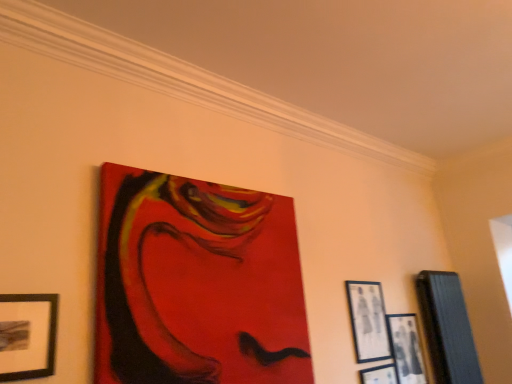
What is the approximate height of matte acrylic painting at upper center, marked as the 5th picture frame in a right-to-left arrangement?

matte acrylic painting at upper center, marked as the 5th picture frame in a right-to-left arrangement, is 32.74 inches in height.

What do you see at coordinates (447, 328) in the screenshot? Image resolution: width=512 pixels, height=384 pixels. I see `wooden picture frame at right, which is the 5th picture frame in left-to-right order` at bounding box center [447, 328].

At what (x,y) coordinates should I click in order to perform the action: click on matte black picture frame at upper right, which is the 4th picture frame from right to left. Please return your answer as a coordinate pair (x, y). The height and width of the screenshot is (384, 512). Looking at the image, I should click on (368, 321).

Describe the element at coordinates (368, 321) in the screenshot. I see `matte black picture frame at upper right, which is the 4th picture frame from right to left` at that location.

Locate an element on the screen. The width and height of the screenshot is (512, 384). matte black picture frame at lower right, which appears as the third picture frame when viewed from the left is located at coordinates (379, 375).

Who is bigger, black matte picture frame at lower right, the fourth picture frame viewed from the left, or matte black picture frame at upper right, which is the 4th picture frame from right to left?

With larger size is matte black picture frame at upper right, which is the 4th picture frame from right to left.

From the image's perspective, is black matte picture frame at lower right, the fourth picture frame viewed from the left, below matte black picture frame at upper right, which is the 4th picture frame from right to left?

Indeed, from the image's perspective, black matte picture frame at lower right, the fourth picture frame viewed from the left, is shown beneath matte black picture frame at upper right, which is the 4th picture frame from right to left.

Is black matte picture frame at lower right, positioned as the 2th picture frame in right-to-left order, not close to matte black picture frame at upper right, which ranks as the 2th picture frame in left-to-right order?

That's not correct — black matte picture frame at lower right, positioned as the 2th picture frame in right-to-left order, is a little close to matte black picture frame at upper right, which ranks as the 2th picture frame in left-to-right order.

Does matte black picture frame at lower right, which is the 3th picture frame from right to left, touch matte black picture frame at upper right, which ranks as the 2th picture frame in left-to-right order?

No, matte black picture frame at lower right, which is the 3th picture frame from right to left, is not making contact with matte black picture frame at upper right, which ranks as the 2th picture frame in left-to-right order.

From the image's perspective, is matte black picture frame at lower right, which is the 3th picture frame from right to left, under matte black picture frame at upper right, which ranks as the 2th picture frame in left-to-right order?

Correct, matte black picture frame at lower right, which is the 3th picture frame from right to left, appears lower than matte black picture frame at upper right, which ranks as the 2th picture frame in left-to-right order, in the image.

Who is shorter, matte black picture frame at lower right, which appears as the third picture frame when viewed from the left, or matte black picture frame at upper right, which ranks as the 2th picture frame in left-to-right order?

matte black picture frame at upper right, which ranks as the 2th picture frame in left-to-right order, is shorter.

Could you tell me if matte black picture frame at lower right, which is the 3th picture frame from right to left, is facing matte black picture frame at upper right, which is the 4th picture frame from right to left?

No, matte black picture frame at lower right, which is the 3th picture frame from right to left, is not aimed at matte black picture frame at upper right, which is the 4th picture frame from right to left.

In terms of width, does matte acrylic painting at upper center, marked as the 5th picture frame in a right-to-left arrangement, look wider or thinner when compared to matte black picture frame at upper right, which is the 4th picture frame from right to left?

matte acrylic painting at upper center, marked as the 5th picture frame in a right-to-left arrangement, is wider than matte black picture frame at upper right, which is the 4th picture frame from right to left.

Would you consider matte acrylic painting at upper center, which is counted as the first picture frame, starting from the left, to be distant from matte black picture frame at upper right, which ranks as the 2th picture frame in left-to-right order?

No, there isn't a large distance between matte acrylic painting at upper center, which is counted as the first picture frame, starting from the left, and matte black picture frame at upper right, which ranks as the 2th picture frame in left-to-right order.

Is matte black picture frame at upper right, which ranks as the 2th picture frame in left-to-right order, at the back of matte acrylic painting at upper center, which is counted as the first picture frame, starting from the left?

No, matte acrylic painting at upper center, which is counted as the first picture frame, starting from the left, is not facing away from matte black picture frame at upper right, which ranks as the 2th picture frame in left-to-right order.

Does point (447, 294) come closer to viewer compared to point (364, 345)?

No.

Considering the relative sizes of wooden picture frame at right, which is the 5th picture frame in left-to-right order, and matte black picture frame at upper right, which ranks as the 2th picture frame in left-to-right order, in the image provided, is wooden picture frame at right, which is the 5th picture frame in left-to-right order, shorter than matte black picture frame at upper right, which ranks as the 2th picture frame in left-to-right order,?

No.

Would you consider wooden picture frame at right, which is the 5th picture frame in left-to-right order, to be distant from matte black picture frame at upper right, which is the 4th picture frame from right to left?

No, there isn't a large distance between wooden picture frame at right, which is the 5th picture frame in left-to-right order, and matte black picture frame at upper right, which is the 4th picture frame from right to left.

Find the location of a particular element. The height and width of the screenshot is (384, 512). the 1st picture frame positioned above the wooden picture frame at right, which is the 1th picture frame in right-to-left order (from the image's perspective) is located at coordinates (368, 321).

In the scene shown: Considering the sizes of objects wooden picture frame at right, which is the 1th picture frame in right-to-left order, and black matte picture frame at lower right, the fourth picture frame viewed from the left, in the image provided, who is taller, wooden picture frame at right, which is the 1th picture frame in right-to-left order, or black matte picture frame at lower right, the fourth picture frame viewed from the left,?

wooden picture frame at right, which is the 1th picture frame in right-to-left order, is taller.

Do you think wooden picture frame at right, which is the 1th picture frame in right-to-left order, is within black matte picture frame at lower right, the fourth picture frame viewed from the left, or outside of it?

wooden picture frame at right, which is the 1th picture frame in right-to-left order, cannot be found inside black matte picture frame at lower right, the fourth picture frame viewed from the left.

I want to click on picture frame that is the 1st object located in front of the wooden picture frame at right, which is the 5th picture frame in left-to-right order, so click(x=406, y=348).

Locate an element on the screen. the 4th picture frame above the matte black picture frame at lower right, which appears as the third picture frame when viewed from the left (from the image's perspective) is located at coordinates (197, 283).

Which of these two, matte acrylic painting at upper center, which is counted as the first picture frame, starting from the left, or matte black picture frame at lower right, which appears as the third picture frame when viewed from the left, stands taller?

matte acrylic painting at upper center, which is counted as the first picture frame, starting from the left.

Is matte acrylic painting at upper center, which is counted as the first picture frame, starting from the left, thinner than matte black picture frame at lower right, which appears as the third picture frame when viewed from the left?

No, matte acrylic painting at upper center, which is counted as the first picture frame, starting from the left, is not thinner than matte black picture frame at lower right, which appears as the third picture frame when viewed from the left.

Between matte acrylic painting at upper center, which is counted as the first picture frame, starting from the left, and matte black picture frame at lower right, which appears as the third picture frame when viewed from the left, which one has smaller size?

With smaller size is matte black picture frame at lower right, which appears as the third picture frame when viewed from the left.

Locate an element on the screen. The width and height of the screenshot is (512, 384). picture frame that is the 3rd object above the black matte picture frame at lower right, the fourth picture frame viewed from the left (from a real-world perspective) is located at coordinates (197, 283).

From a real-world perspective, which is physically below, matte acrylic painting at upper center, marked as the 5th picture frame in a right-to-left arrangement, or black matte picture frame at lower right, positioned as the 2th picture frame in right-to-left order?

black matte picture frame at lower right, positioned as the 2th picture frame in right-to-left order, is physically lower.

Does matte acrylic painting at upper center, marked as the 5th picture frame in a right-to-left arrangement, have a larger size compared to black matte picture frame at lower right, positioned as the 2th picture frame in right-to-left order?

Correct, matte acrylic painting at upper center, marked as the 5th picture frame in a right-to-left arrangement, is larger in size than black matte picture frame at lower right, positioned as the 2th picture frame in right-to-left order.

Is matte acrylic painting at upper center, marked as the 5th picture frame in a right-to-left arrangement, turned away from black matte picture frame at lower right, positioned as the 2th picture frame in right-to-left order?

That's not correct — matte acrylic painting at upper center, marked as the 5th picture frame in a right-to-left arrangement, is not looking away from black matte picture frame at lower right, positioned as the 2th picture frame in right-to-left order.

Where is `the 2nd picture frame above the black matte picture frame at lower right, the fourth picture frame viewed from the left (from the image's perspective)`? The image size is (512, 384). the 2nd picture frame above the black matte picture frame at lower right, the fourth picture frame viewed from the left (from the image's perspective) is located at coordinates (368, 321).

Image resolution: width=512 pixels, height=384 pixels. I want to click on the 1st picture frame to the right of the matte black picture frame at upper right, which is the 4th picture frame from right to left, starting your count from the anchor, so click(x=379, y=375).

Looking at the image, which one is located closer to black matte picture frame at lower right, positioned as the 2th picture frame in right-to-left order, wooden picture frame at right, which is the 5th picture frame in left-to-right order, or matte black picture frame at lower right, which is the 3th picture frame from right to left?

Among the two, matte black picture frame at lower right, which is the 3th picture frame from right to left, is located nearer to black matte picture frame at lower right, positioned as the 2th picture frame in right-to-left order.

Considering their positions, is matte acrylic painting at upper center, which is counted as the first picture frame, starting from the left, positioned further to black matte picture frame at lower right, the fourth picture frame viewed from the left, than wooden picture frame at right, which is the 1th picture frame in right-to-left order?

matte acrylic painting at upper center, which is counted as the first picture frame, starting from the left, lies further to black matte picture frame at lower right, the fourth picture frame viewed from the left, than the other object.

From the image, which object appears to be farther from matte black picture frame at upper right, which is the 4th picture frame from right to left, black matte picture frame at lower right, positioned as the 2th picture frame in right-to-left order, or wooden picture frame at right, which is the 1th picture frame in right-to-left order?

wooden picture frame at right, which is the 1th picture frame in right-to-left order.

Looking at the image, which one is located closer to matte black picture frame at upper right, which ranks as the 2th picture frame in left-to-right order, wooden picture frame at right, which is the 1th picture frame in right-to-left order, or matte acrylic painting at upper center, marked as the 5th picture frame in a right-to-left arrangement?

wooden picture frame at right, which is the 1th picture frame in right-to-left order, is closer to matte black picture frame at upper right, which ranks as the 2th picture frame in left-to-right order.

Considering their positions, is black matte picture frame at lower right, the fourth picture frame viewed from the left, positioned further to wooden picture frame at right, which is the 5th picture frame in left-to-right order, than matte black picture frame at lower right, which is the 3th picture frame from right to left?

matte black picture frame at lower right, which is the 3th picture frame from right to left, is further to wooden picture frame at right, which is the 5th picture frame in left-to-right order.

Considering their positions, is matte black picture frame at upper right, which is the 4th picture frame from right to left, positioned closer to matte black picture frame at lower right, which is the 3th picture frame from right to left, than wooden picture frame at right, which is the 1th picture frame in right-to-left order?

matte black picture frame at upper right, which is the 4th picture frame from right to left, is positioned closer to the anchor matte black picture frame at lower right, which is the 3th picture frame from right to left.

Estimate the real-world distances between objects in this image. Which object is closer to wooden picture frame at right, which is the 1th picture frame in right-to-left order, matte black picture frame at upper right, which ranks as the 2th picture frame in left-to-right order, or matte acrylic painting at upper center, marked as the 5th picture frame in a right-to-left arrangement?

matte black picture frame at upper right, which ranks as the 2th picture frame in left-to-right order.

Considering their positions, is matte acrylic painting at upper center, which is counted as the first picture frame, starting from the left, positioned further to matte black picture frame at upper right, which is the 4th picture frame from right to left, than black matte picture frame at lower right, the fourth picture frame viewed from the left?

The object further to matte black picture frame at upper right, which is the 4th picture frame from right to left, is matte acrylic painting at upper center, which is counted as the first picture frame, starting from the left.

Find the location of a particular element. The width and height of the screenshot is (512, 384). picture frame located between matte black picture frame at lower right, which is the 3th picture frame from right to left, and wooden picture frame at right, which is the 5th picture frame in left-to-right order, in the left-right direction is located at coordinates (406, 348).

Where is `picture frame between matte acrylic painting at upper center, which is counted as the first picture frame, starting from the left, and matte black picture frame at upper right, which ranks as the 2th picture frame in left-to-right order, from front to back`? The width and height of the screenshot is (512, 384). picture frame between matte acrylic painting at upper center, which is counted as the first picture frame, starting from the left, and matte black picture frame at upper right, which ranks as the 2th picture frame in left-to-right order, from front to back is located at coordinates (379, 375).